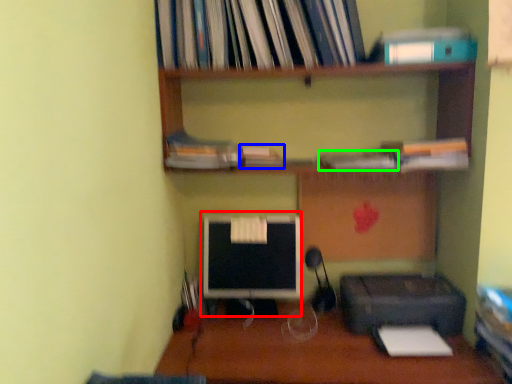
Question: Estimate the real-world distances between objects in this image. Which object is closer to computer monitor (highlighted by a red box), book (highlighted by a blue box) or book (highlighted by a green box)?

Choices:
 (A) book
 (B) book

Answer: (A)